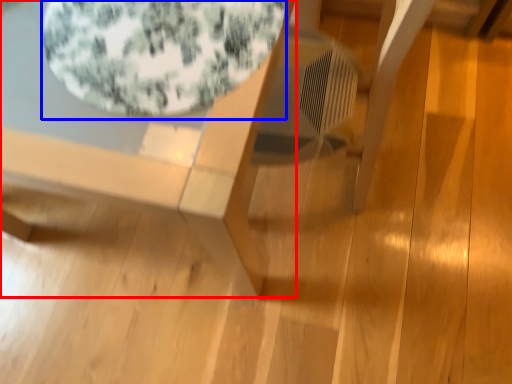
Question: Among these objects, which one is nearest to the camera, table (highlighted by a red box) or bean bag chair (highlighted by a blue box)?

Choices:
 (A) table
 (B) bean bag chair

Answer: (A)